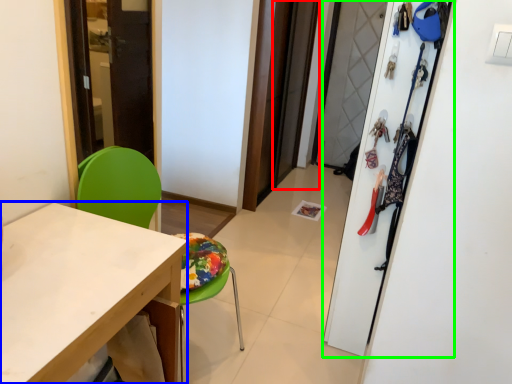
Question: Estimate the real-world distances between objects in this image. Which object is farther from screen door (highlighted by a red box), desk (highlighted by a blue box) or closet (highlighted by a green box)?

Choices:
 (A) desk
 (B) closet

Answer: (A)